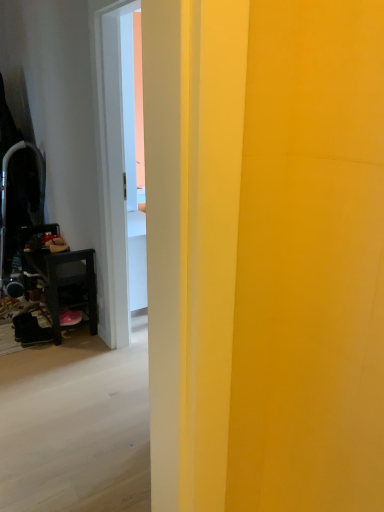
Question: From the image's perspective, is pink suede shoe at lower left, which is counted as the first footwear, starting from the right, above or below black suede boot at lower left, the 1th footwear from the left?

Choices:
 (A) above
 (B) below

Answer: (A)

Question: Which is correct: pink suede shoe at lower left, which is counted as the first footwear, starting from the right, is inside black suede boot at lower left, which is the second footwear in right-to-left order, or outside of it?

Choices:
 (A) outside
 (B) inside

Answer: (A)

Question: Considering the real-world distances, which object is farthest from the wooden dark brown table at left?

Choices:
 (A) pink suede shoe at lower left, which is counted as the first footwear, starting from the right
 (B) black suede boot at lower left, the 1th footwear from the left
 (C) metallic black swivel chair at left

Answer: (C)

Question: Which object is positioned closest to the black suede boot at lower left, which is the second footwear in right-to-left order?

Choices:
 (A) metallic black swivel chair at left
 (B) pink suede shoe at lower left, the 2th footwear from the left
 (C) wooden dark brown table at left

Answer: (B)